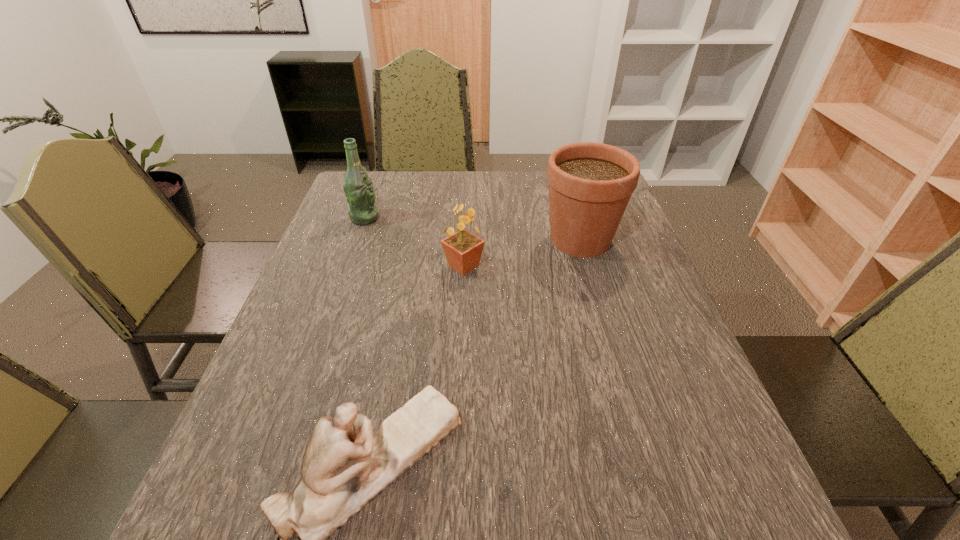
Where is `vacant space at the left edge`? vacant space at the left edge is located at coordinates (219, 493).

In the image, there is a desktop. Where is `vacant area at the right edge`? vacant area at the right edge is located at coordinates 620,233.

Find the location of a particular element. The width and height of the screenshot is (960, 540). vacant space at the near right corner of the desktop is located at coordinates (720, 534).

What are the coordinates of `vacant space that's between the sunflower and the flowerpot` in the screenshot? It's located at (522, 253).

The image size is (960, 540). Find the location of `vacant area between the beer bottle and the rightmost object`. vacant area between the beer bottle and the rightmost object is located at coordinates (472, 229).

Locate an element on the screen. Image resolution: width=960 pixels, height=540 pixels. free space between the rightmost object and the sunflower is located at coordinates (522, 253).

Choose which object is the second nearest neighbor to the sunflower. Please provide its 2D coordinates. Your answer should be formatted as a tuple, i.e. [(x, y)], where the tuple contains the x and y coordinates of a point satisfying the conditions above.

[(358, 188)]

Select which object is the second closest to the sunflower. Please provide its 2D coordinates. Your answer should be formatted as a tuple, i.e. [(x, y)], where the tuple contains the x and y coordinates of a point satisfying the conditions above.

[(358, 188)]

The image size is (960, 540). Find the location of `blank space that satisfies the following two spatial constraints: 1. on the surface of the flowerpot; 2. on the right side of the beer bottle`. blank space that satisfies the following two spatial constraints: 1. on the surface of the flowerpot; 2. on the right side of the beer bottle is located at coordinates (357, 240).

Where is `vacant area in the image that satisfies the following two spatial constraints: 1. on the surface of the rightmost object; 2. on the right side of the beer bottle`? The image size is (960, 540). vacant area in the image that satisfies the following two spatial constraints: 1. on the surface of the rightmost object; 2. on the right side of the beer bottle is located at coordinates (357, 240).